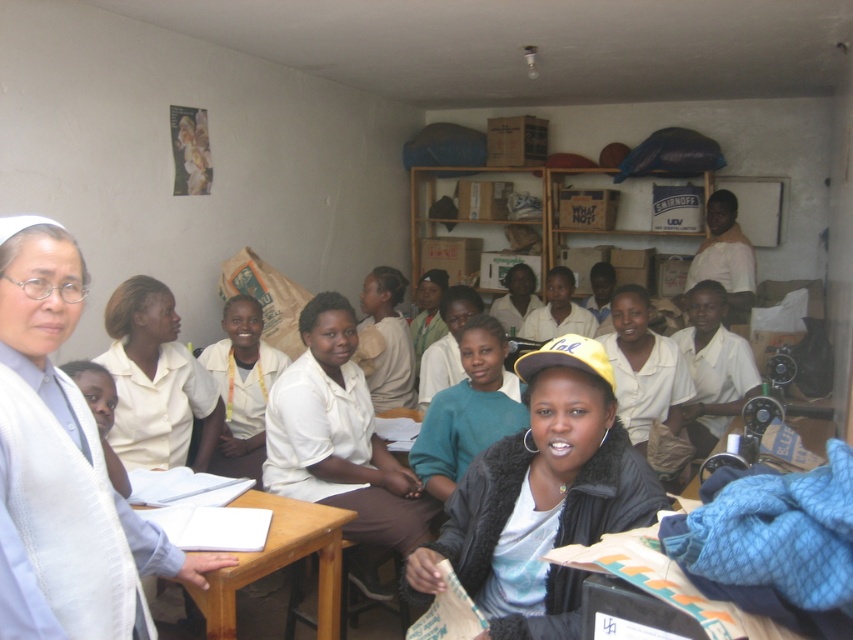
Between point (370, 481) and point (450, 484), which one is positioned in front?

Point (450, 484)

Does point (328, 301) lie in front of point (468, 445)?

No, it is not.

Does point (300, 317) come in front of point (434, 472)?

No, it is not.

At what (x,y) coordinates should I click in order to perform the action: click on white matte shirt at center. Please return your answer as a coordinate pair (x, y). Looking at the image, I should click on (341, 445).

Which is more to the right, teal matte sweater at center or wooden table at center?

teal matte sweater at center

Identify the location of teal matte sweater at center. (468, 410).

Does point (469, 326) come behind point (328, 605)?

Yes, it is behind point (328, 605).

Identify the location of teal matte sweater at center. This screenshot has width=853, height=640. (468, 410).

Who is lower down, white matte vest at left or white matte shirt at center?

white matte shirt at center is lower down.

Can you confirm if white matte vest at left is shorter than white matte shirt at center?

Indeed, white matte vest at left has a lesser height compared to white matte shirt at center.

Is point (165, 550) positioned after point (376, 588)?

No, it is not.

You are a GUI agent. You are given a task and a screenshot of the screen. Output one action in this format:
    pyautogui.click(x=<x>, y=<y>)
    Task: Click on the white matte vest at left
    
    Given the screenshot: What is the action you would take?
    pyautogui.click(x=62, y=467)